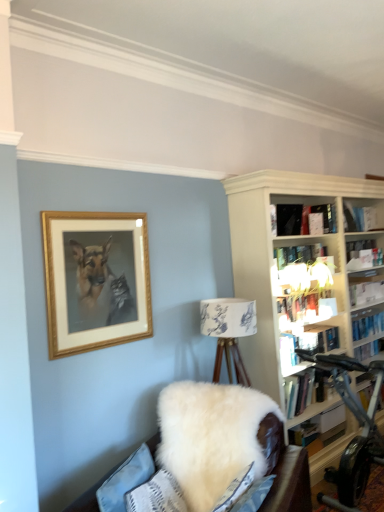
Question: Is wooden picture frame at upper left oriented away from hardcover book at upper right, the third book when ordered from bottom to top?

Choices:
 (A) yes
 (B) no

Answer: (B)

Question: Considering the relative sizes of wooden picture frame at upper left and hardcover book at upper right, marked as the fourth book in a top-to-bottom arrangement, in the image provided, is wooden picture frame at upper left smaller than hardcover book at upper right, marked as the fourth book in a top-to-bottom arrangement,?

Choices:
 (A) no
 (B) yes

Answer: (A)

Question: Is wooden picture frame at upper left touching hardcover book at upper right, the third book when ordered from bottom to top?

Choices:
 (A) no
 (B) yes

Answer: (A)

Question: From the image's perspective, does wooden picture frame at upper left appear lower than hardcover book at upper right, marked as the fourth book in a top-to-bottom arrangement?

Choices:
 (A) no
 (B) yes

Answer: (A)

Question: Is there a large distance between wooden picture frame at upper left and hardcover book at upper right, the third book when ordered from bottom to top?

Choices:
 (A) no
 (B) yes

Answer: (B)

Question: Is black matte book at upper center, which is the first book in top-to-bottom order, inside the boundaries of silver metallic stationary bicycle at right, or outside?

Choices:
 (A) inside
 (B) outside

Answer: (B)

Question: From a real-world perspective, relative to silver metallic stationary bicycle at right, is black matte book at upper center, which is the first book in top-to-bottom order, vertically above or below?

Choices:
 (A) below
 (B) above

Answer: (B)

Question: Based on their positions, is black matte book at upper center, which is the 6th book in bottom-to-top order, located to the left or right of silver metallic stationary bicycle at right?

Choices:
 (A) left
 (B) right

Answer: (A)

Question: Is point (297, 224) positioned closer to the camera than point (350, 393)?

Choices:
 (A) farther
 (B) closer

Answer: (A)

Question: Is silver metallic stationary bicycle at right spatially inside hardcover book at upper right, the third book when ordered from bottom to top, or outside of it?

Choices:
 (A) outside
 (B) inside

Answer: (A)

Question: Considering the positions of silver metallic stationary bicycle at right and hardcover book at upper right, the third book when ordered from bottom to top, in the image, is silver metallic stationary bicycle at right taller or shorter than hardcover book at upper right, the third book when ordered from bottom to top,?

Choices:
 (A) short
 (B) tall

Answer: (B)

Question: Looking at their shapes, would you say silver metallic stationary bicycle at right is wider or thinner than hardcover book at upper right, marked as the fourth book in a top-to-bottom arrangement?

Choices:
 (A) wide
 (B) thin

Answer: (A)

Question: From the image's perspective, is silver metallic stationary bicycle at right positioned above or below hardcover book at upper right, marked as the fourth book in a top-to-bottom arrangement?

Choices:
 (A) above
 (B) below

Answer: (B)

Question: From a real-world perspective, is white fluffy couch at lower center above or below hardcover book at center-right, which is the second book from bottom to top?

Choices:
 (A) above
 (B) below

Answer: (B)

Question: In the image, is white fluffy couch at lower center positioned in front of or behind hardcover book at center-right, which is counted as the fifth book, starting from the top?

Choices:
 (A) front
 (B) behind

Answer: (A)